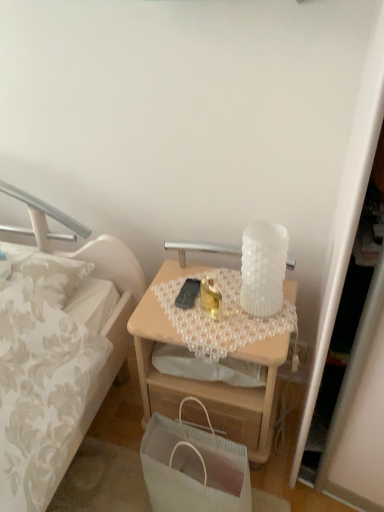
Question: Is white textured glass at upper center not near black matte mobile phone at center?

Choices:
 (A) no
 (B) yes

Answer: (A)

Question: Is white textured glass at upper center turned away from black matte mobile phone at center?

Choices:
 (A) no
 (B) yes

Answer: (A)

Question: Can you confirm if white textured glass at upper center is positioned to the left of black matte mobile phone at center?

Choices:
 (A) yes
 (B) no

Answer: (B)

Question: Does white textured glass at upper center appear on the right side of black matte mobile phone at center?

Choices:
 (A) no
 (B) yes

Answer: (B)

Question: Would you say white textured glass at upper center contains black matte mobile phone at center?

Choices:
 (A) no
 (B) yes

Answer: (A)

Question: From a real-world perspective, relative to white ribbed paper bag at lower center, is white textured glass at upper center vertically above or below?

Choices:
 (A) below
 (B) above

Answer: (B)

Question: From their relative heights in the image, would you say white textured glass at upper center is taller or shorter than white ribbed paper bag at lower center?

Choices:
 (A) short
 (B) tall

Answer: (A)

Question: In the image, is white textured glass at upper center on the left side or the right side of white ribbed paper bag at lower center?

Choices:
 (A) left
 (B) right

Answer: (B)

Question: Considering the positions of white textured glass at upper center and white ribbed paper bag at lower center in the image, is white textured glass at upper center wider or thinner than white ribbed paper bag at lower center?

Choices:
 (A) thin
 (B) wide

Answer: (A)

Question: In terms of size, does white ribbed paper bag at lower center appear bigger or smaller than white textured glass at upper center?

Choices:
 (A) big
 (B) small

Answer: (A)

Question: Based on their positions, is white ribbed paper bag at lower center located to the left or right of white textured glass at upper center?

Choices:
 (A) left
 (B) right

Answer: (A)

Question: From a real-world perspective, is white ribbed paper bag at lower center positioned above or below white textured glass at upper center?

Choices:
 (A) above
 (B) below

Answer: (B)

Question: Is point (198, 402) closer or farther from the camera than point (208, 244)?

Choices:
 (A) farther
 (B) closer

Answer: (B)

Question: Considering their positions, is white ribbed paper bag at lower center located in front of or behind light wood desk at center?

Choices:
 (A) behind
 (B) front

Answer: (B)

Question: Is white ribbed paper bag at lower center inside or outside of light wood desk at center?

Choices:
 (A) outside
 (B) inside

Answer: (A)